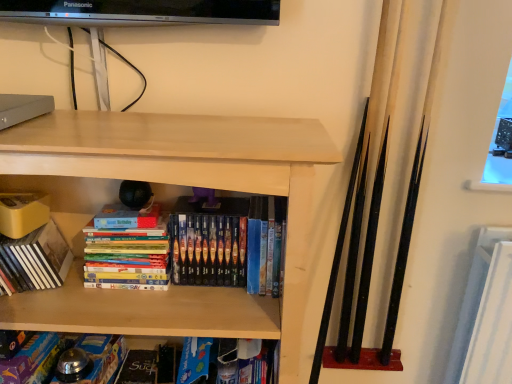
I want to click on free space above hardcover books at center, which appears as the 1th book when viewed from the right (from a real-world perspective), so click(x=240, y=199).